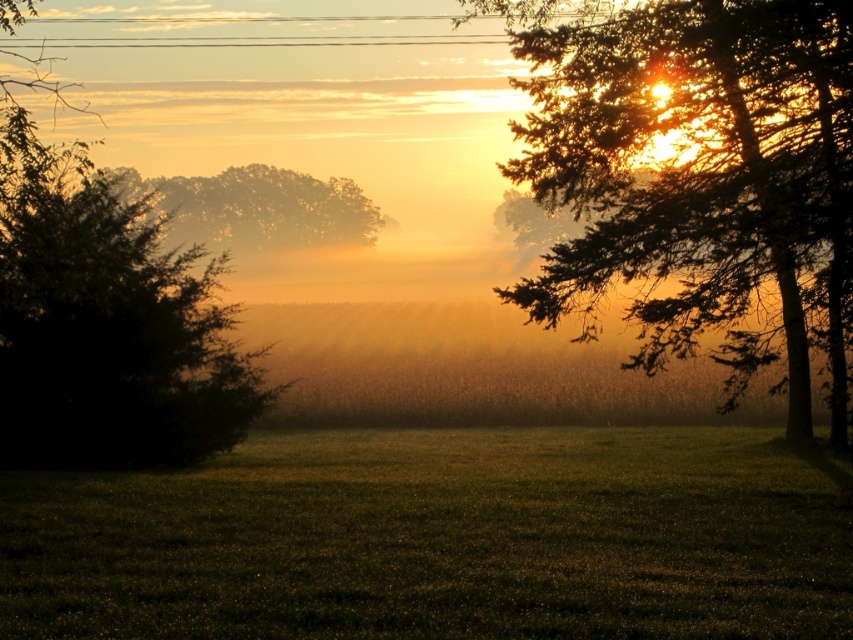
Who is more distant from viewer, (556, 6) or (212, 195)?

Positioned behind is point (212, 195).

Which is behind, point (693, 278) or point (312, 196)?

The point (312, 196) is more distant.

This screenshot has height=640, width=853. I want to click on green leafy tree at upper right, so click(695, 173).

Who is shorter, green grassy field at center or green leafy tree at upper right?

With less height is green grassy field at center.

Which of these two, green grassy field at center or green leafy tree at upper right, stands taller?

green leafy tree at upper right is taller.

Who is more forward, (740, 570) or (706, 202)?

Point (740, 570)

I want to click on green grassy field at center, so click(439, 540).

What do you see at coordinates (439, 540) in the screenshot? I see `green grassy field at center` at bounding box center [439, 540].

Find the location of a particular element. green grassy field at center is located at coordinates (439, 540).

Image resolution: width=853 pixels, height=640 pixels. I want to click on green grassy field at center, so pos(439,540).